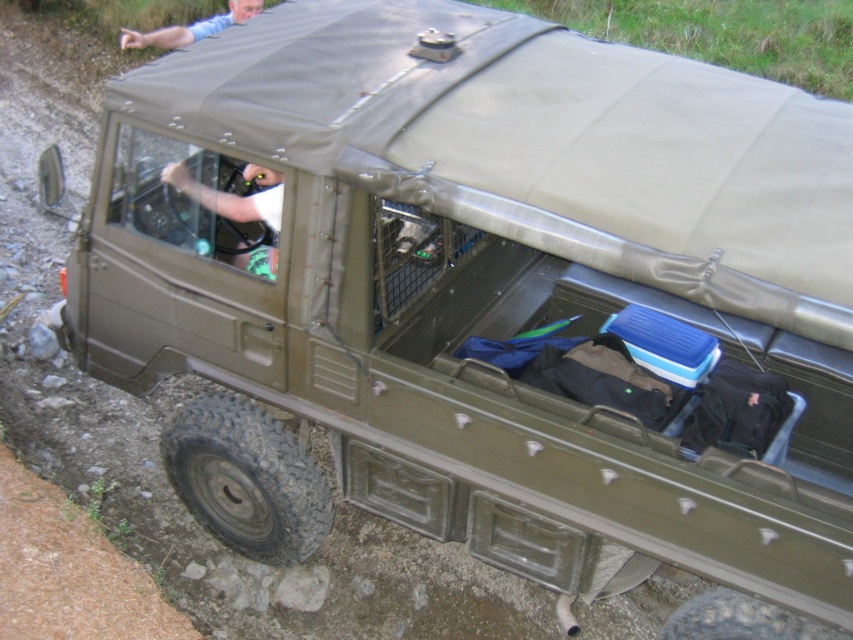
Measure the distance between white fabric shirt at center and camera.

A distance of 3.27 meters exists between white fabric shirt at center and camera.

Between point (274, 182) and point (204, 29), which one is positioned behind?

The point (204, 29) is behind.

Find the location of a particular element. white fabric shirt at center is located at coordinates (233, 195).